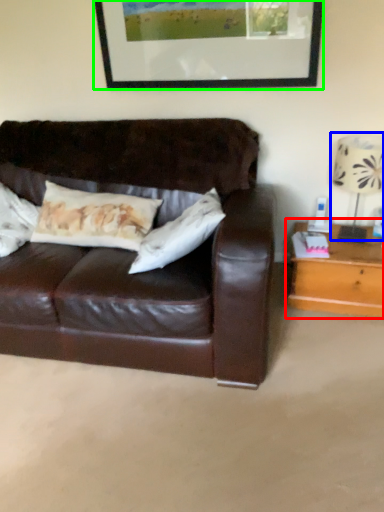
Question: Estimate the real-world distances between objects in this image. Which object is farther from table (highlighted by a red box), table lamp (highlighted by a blue box) or picture frame (highlighted by a green box)?

Choices:
 (A) table lamp
 (B) picture frame

Answer: (B)